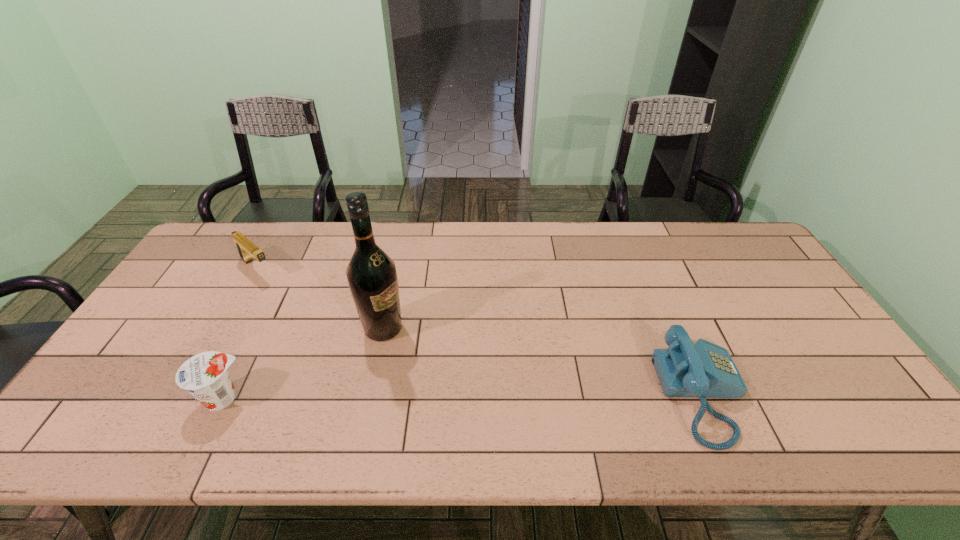
Image resolution: width=960 pixels, height=540 pixels. In order to click on free space at the left edge in this screenshot , I will do `click(195, 282)`.

Find the location of `vacant space at the right edge of the desktop`. vacant space at the right edge of the desktop is located at coordinates (750, 273).

In the image, there is a desktop. At what (x,y) coordinates should I click in order to perform the action: click on vacant space at the far left corner. Please return your answer as a coordinate pair (x, y). Looking at the image, I should click on (210, 260).

In the image, there is a desktop. Identify the location of vacant space at the far right corner. (745, 247).

The height and width of the screenshot is (540, 960). Identify the location of vacant space that's between the second object from right to left and the yogurt. tap(303, 363).

Find the location of a particular element. The height and width of the screenshot is (540, 960). vacant region between the third object from left to right and the pistol is located at coordinates (320, 298).

This screenshot has width=960, height=540. I want to click on vacant area that lies between the wine bottle and the yogurt, so click(303, 363).

Image resolution: width=960 pixels, height=540 pixels. Find the location of `blank region between the telephone and the pistol`. blank region between the telephone and the pistol is located at coordinates (480, 332).

At what (x,y) coordinates should I click in order to perform the action: click on free space between the wine bottle and the pistol. Please return your answer as a coordinate pair (x, y). This screenshot has height=540, width=960. Looking at the image, I should click on (320, 298).

Where is `empty space that is in between the telephone and the second object from right to left`? Image resolution: width=960 pixels, height=540 pixels. empty space that is in between the telephone and the second object from right to left is located at coordinates (543, 361).